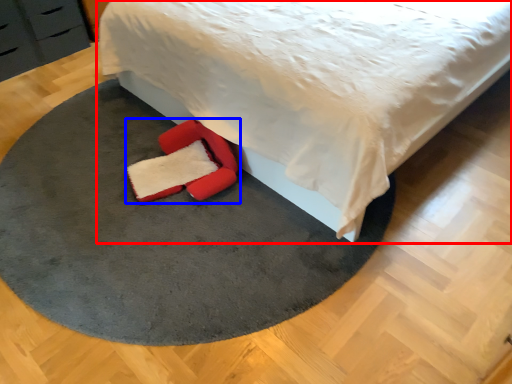
Question: Among these objects, which one is farthest to the camera, bed (highlighted by a red box) or footwear (highlighted by a blue box)?

Choices:
 (A) bed
 (B) footwear

Answer: (B)